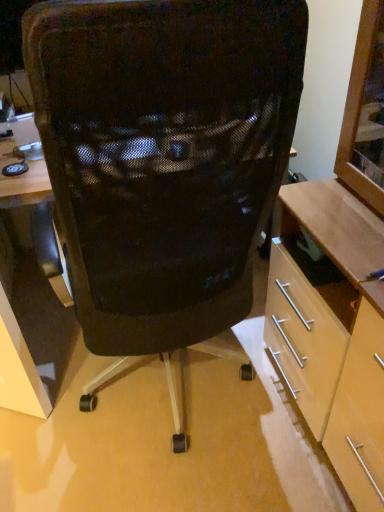
Find the location of a particular element. This screenshot has height=512, width=384. free point below black mesh chair at center (from a real-world perspective) is located at coordinates (183, 397).